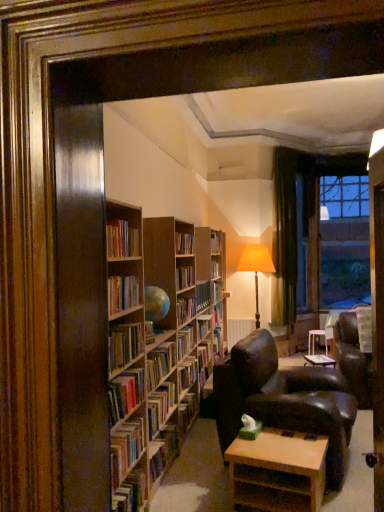
You are a GUI agent. You are given a task and a screenshot of the screen. Output one action in this format:
    pyautogui.click(x=<x>, y=<y>)
    Task: Click on the blank space situated above light brown wooden table at lower center (from a real-world perspective)
    The width and height of the screenshot is (384, 512).
    Given the screenshot: What is the action you would take?
    pyautogui.click(x=274, y=447)